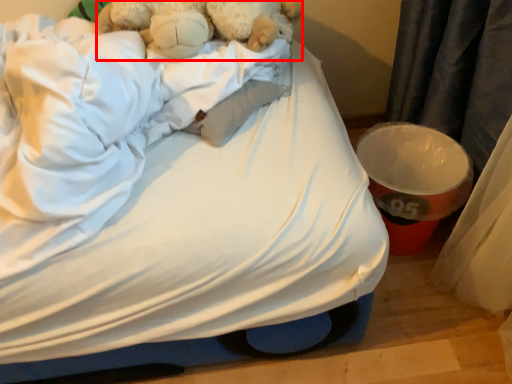
Question: From the image's perspective, what is the correct spatial relationship of teddy bear (annotated by the red box) in relation to bed?

Choices:
 (A) above
 (B) below

Answer: (A)